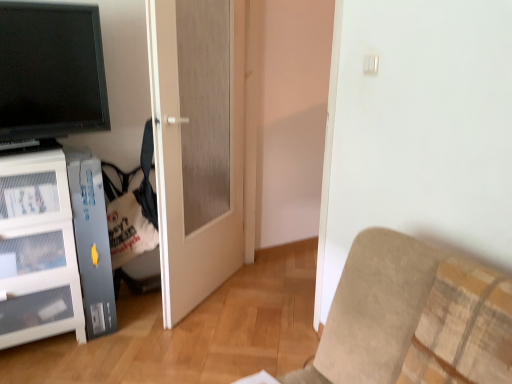
Question: Can you confirm if beige fabric couch at lower right is wider than matte white door at center?

Choices:
 (A) yes
 (B) no

Answer: (A)

Question: Does beige fabric couch at lower right appear on the right side of matte white door at center?

Choices:
 (A) no
 (B) yes

Answer: (B)

Question: Considering the relative sizes of beige fabric couch at lower right and matte white door at center in the image provided, is beige fabric couch at lower right bigger than matte white door at center?

Choices:
 (A) yes
 (B) no

Answer: (A)

Question: From the image's perspective, is beige fabric couch at lower right on top of matte white door at center?

Choices:
 (A) yes
 (B) no

Answer: (B)

Question: Is beige fabric couch at lower right shorter than matte white door at center?

Choices:
 (A) yes
 (B) no

Answer: (A)

Question: Does beige fabric couch at lower right have a lesser width compared to matte white door at center?

Choices:
 (A) no
 (B) yes

Answer: (A)

Question: Is matte white door at center wider than beige fabric couch at lower right?

Choices:
 (A) no
 (B) yes

Answer: (A)

Question: Is matte white door at center facing away from beige fabric couch at lower right?

Choices:
 (A) no
 (B) yes

Answer: (A)

Question: Is the depth of matte white door at center greater than that of beige fabric couch at lower right?

Choices:
 (A) no
 (B) yes

Answer: (B)

Question: Can you confirm if matte white door at center is shorter than beige fabric couch at lower right?

Choices:
 (A) yes
 (B) no

Answer: (B)

Question: Is matte white door at center aimed at beige fabric couch at lower right?

Choices:
 (A) no
 (B) yes

Answer: (A)

Question: Is beige fabric couch at lower right located within matte white door at center?

Choices:
 (A) no
 (B) yes

Answer: (A)

Question: From the image's perspective, is matte white door at center on matte black tv at upper left?

Choices:
 (A) no
 (B) yes

Answer: (A)